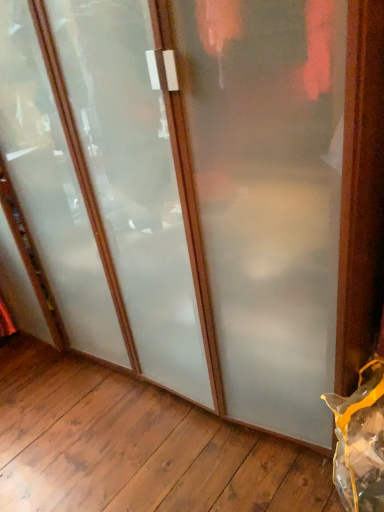
Find the location of `yellow plastic bag at lower right`. yellow plastic bag at lower right is located at coordinates point(360,441).

The height and width of the screenshot is (512, 384). Describe the element at coordinates (360, 441) in the screenshot. I see `yellow plastic bag at lower right` at that location.

You are a GUI agent. You are given a task and a screenshot of the screen. Output one action in this format:
    pyautogui.click(x=<x>, y=<y>)
    Task: Click on the yellow plastic bag at lower right
    The image size is (384, 512).
    Given the screenshot: What is the action you would take?
    click(360, 441)